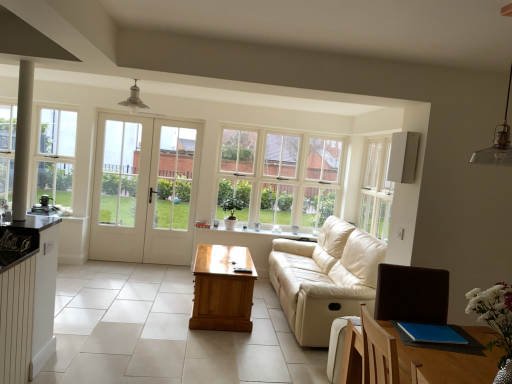
Question: Does point (309, 172) appear closer or farther from the camera than point (228, 309)?

Choices:
 (A) farther
 (B) closer

Answer: (A)

Question: Is clear glass window at center, which is the first window from right to left, taller or shorter than light brown wooden table at center?

Choices:
 (A) short
 (B) tall

Answer: (B)

Question: Which of these objects is positioned closest to the clear glass window at left, which ranks as the 2th window in right-to-left order?

Choices:
 (A) matte black coffee machine at left, marked as the 2th appliance in a right-to-left arrangement
 (B) beige leather couch at center
 (C) white plastic air purifier at upper right, the 1th appliance in the right-to-left sequence
 (D) white glass door at center
 (E) metallic pendant light at upper right

Answer: (D)

Question: Which object is the closest to the clear glass window at center, which is the first window from right to left?

Choices:
 (A) clear glass window at left, marked as the first window in a front-to-back arrangement
 (B) white glass door at center
 (C) matte black coffee machine at left, marked as the 2th appliance in a right-to-left arrangement
 (D) beige leather couch at center
 (E) white glass door at center

Answer: (E)